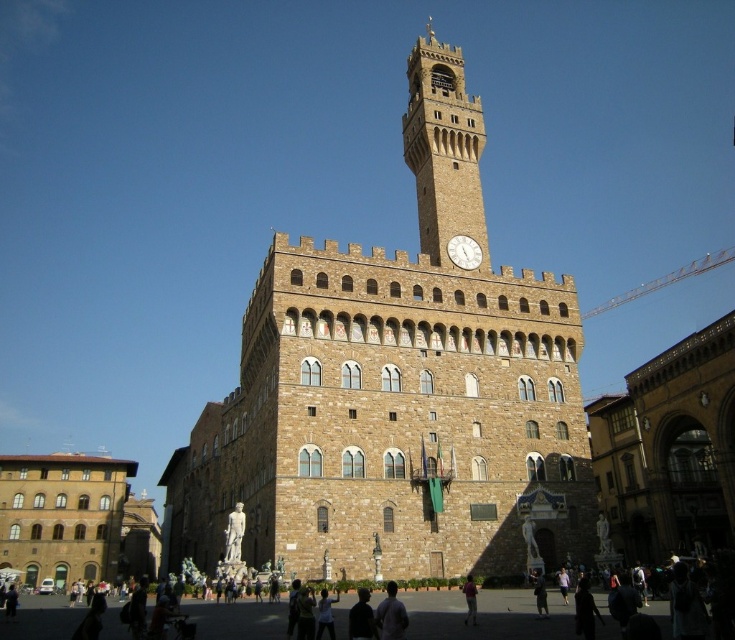
You are standing in front of a historical building and notice a light blue shirt at lower center and a white stone clock at center. Which object is closer to the left side of the building?

The light blue shirt at lower center is positioned on the left side of the white stone clock at center, so it is closer to the left side of the building.

You are a photographer standing at the base of the historical building. You want to take a photo that includes both the light blue shirt at lower center and the dark brown leather jacket at lower center. Given that your camera has a maximum zoom range of 5 meters, will you be able to capture both subjects in the same frame without moving closer?

The distance between the light blue shirt at lower center and the dark brown leather jacket at lower center is 6.56 meters. Since your camera can only zoom up to 5 meters, you won cannot capture both subjects in the same frame without moving closer.